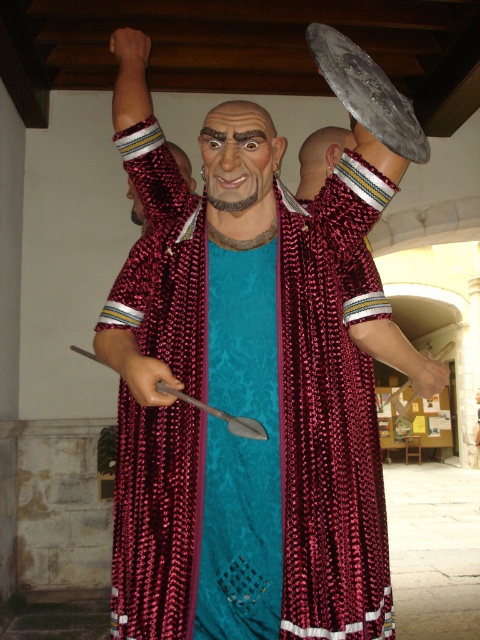
Question: Which point is farther from the camera taking this photo?

Choices:
 (A) (316, 307)
 (B) (184, 182)
 (C) (340, 154)

Answer: (C)

Question: Estimate the real-world distances between objects in this image. Which object is closer to the matte plastic head at center?

Choices:
 (A) matte gold earring at upper center
 (B) shiny red fabric head at upper center

Answer: (B)

Question: Does shiny red cape at center appear under metallic sheen sword at lower center?

Choices:
 (A) yes
 (B) no

Answer: (B)

Question: Observing the image, what is the correct spatial positioning of matte gold earring at upper center in reference to shiny red fabric head at upper center?

Choices:
 (A) below
 (B) above

Answer: (B)

Question: Is metallic sheen sword at lower center positioned in front of shiny red fabric head at upper center?

Choices:
 (A) yes
 (B) no

Answer: (A)

Question: Which point appears farthest from the camera in this image?

Choices:
 (A) (130, 180)
 (B) (232, 186)
 (C) (143, 388)

Answer: (A)